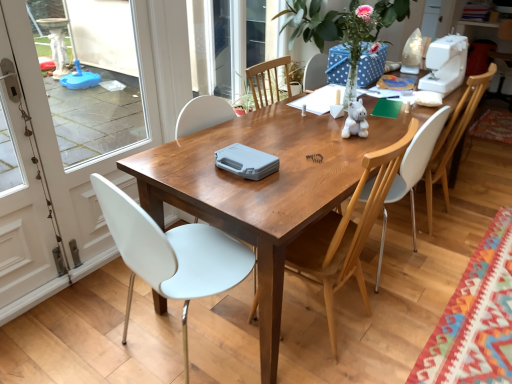
Where is `free space in front of white plastic chair at center, marked as the second chair in a right-to-left arrangement`? This screenshot has height=384, width=512. free space in front of white plastic chair at center, marked as the second chair in a right-to-left arrangement is located at coordinates (403, 313).